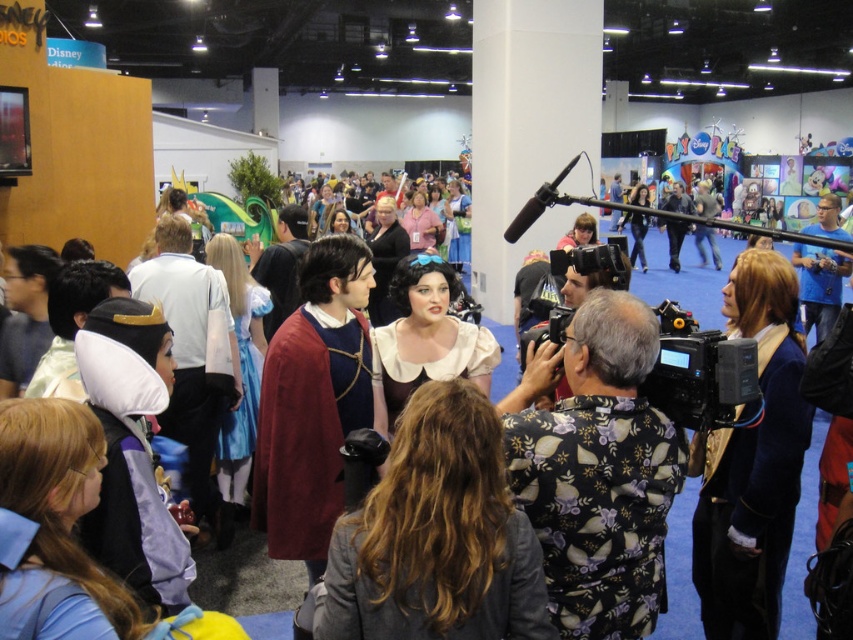
How far apart are dark brown hair at center and blue velvet jacket at right?

They are 3.75 feet apart.

Between point (451, 593) and point (767, 496), which one is positioned behind?

Point (767, 496)

Is point (479, 586) closer to camera compared to point (764, 458)?

Yes, point (479, 586) is closer to viewer.

I want to click on dark brown hair at center, so click(436, 536).

Between floral-patterned shirt at center-right and blue velvet jacket at right, which one has more height?

blue velvet jacket at right is taller.

Who is positioned more to the left, floral-patterned shirt at center-right or blue velvet jacket at right?

floral-patterned shirt at center-right

Is point (625, 433) behind point (756, 284)?

No, (625, 433) is closer to viewer.

Identify the location of floral-patterned shirt at center-right. The width and height of the screenshot is (853, 640). (x=596, y=468).

In the scene shown: Can you confirm if blue velvet jacket at right is positioned to the left of smooth white wig at center?

Indeed, blue velvet jacket at right is positioned on the left side of smooth white wig at center.

Which is more to the right, blue velvet jacket at right or smooth white wig at center?

smooth white wig at center is more to the right.

Who is more forward, (x=792, y=476) or (x=799, y=580)?

Point (x=792, y=476)

What are the coordinates of `blue velvet jacket at right` in the screenshot? It's located at (752, 461).